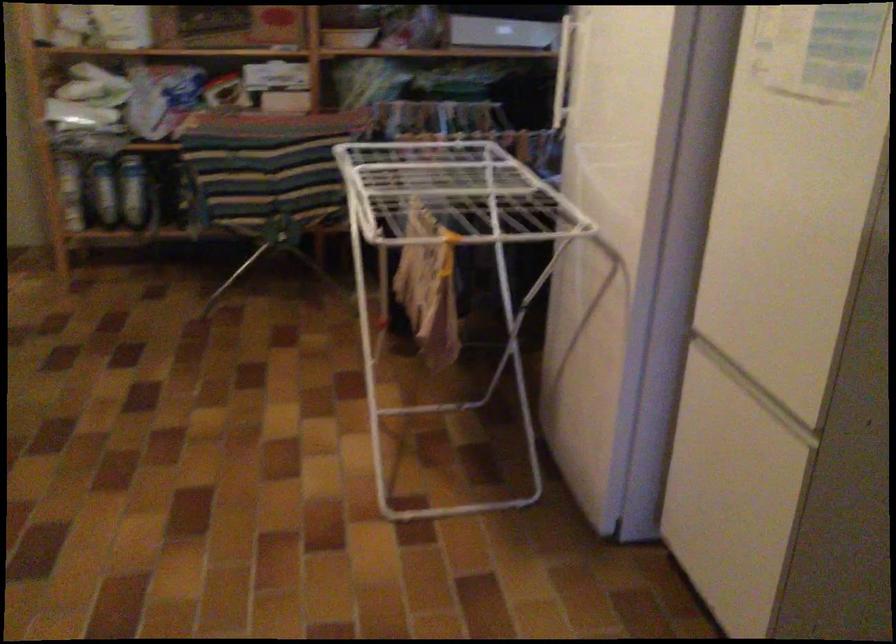
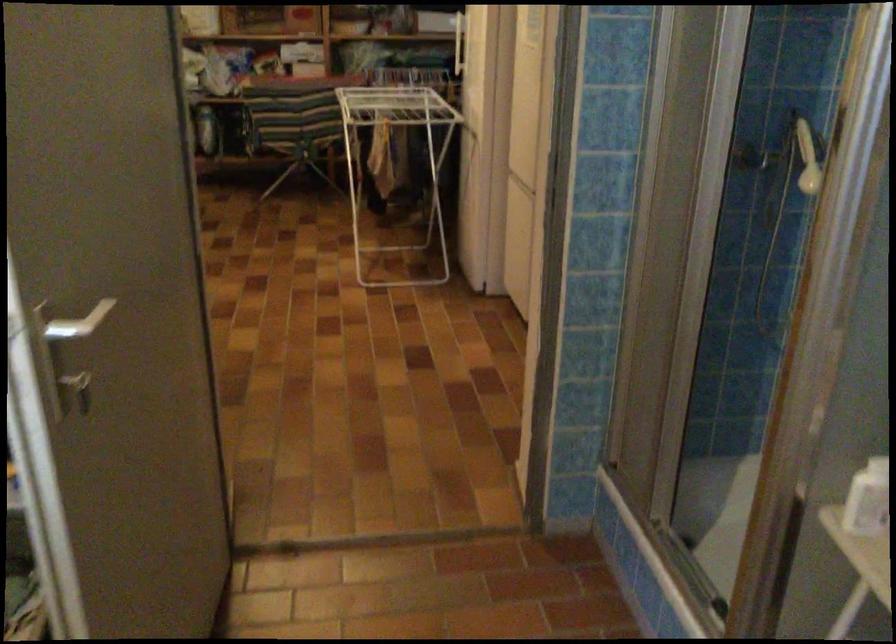
Question: I am providing you with two images of the same scene from different viewpoints. Which of the following objects are not visible in image2?

Choices:
 (A) shower door handle
 (B) blue bottle
 (C) silver door handle
 (D) floral pattern pillow

Answer: (B)